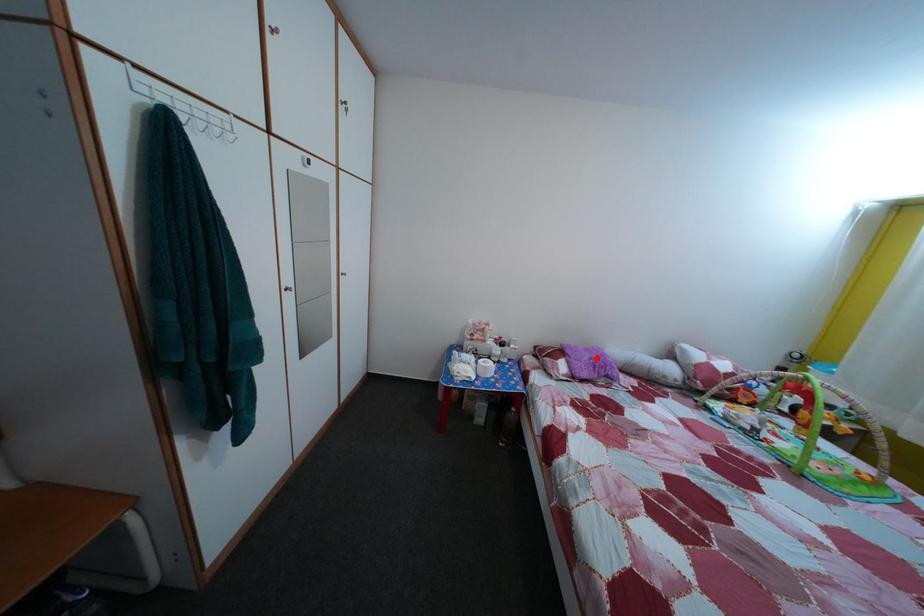
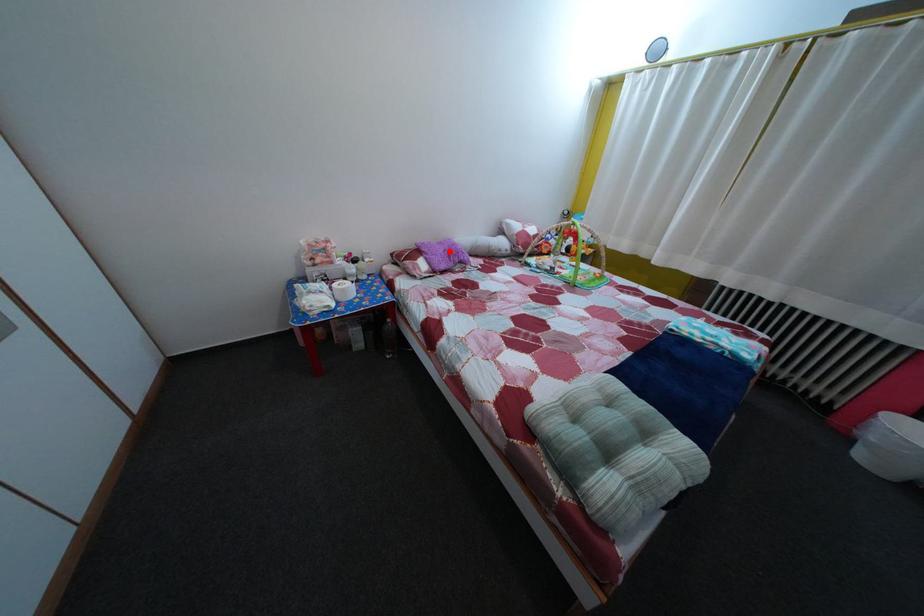
I am providing you with two images of the same scene from different viewpoints. A red point is marked on the first image and another point is marked on the second image. Is the red point in image1 aligned with the point shown in image2?

Yes